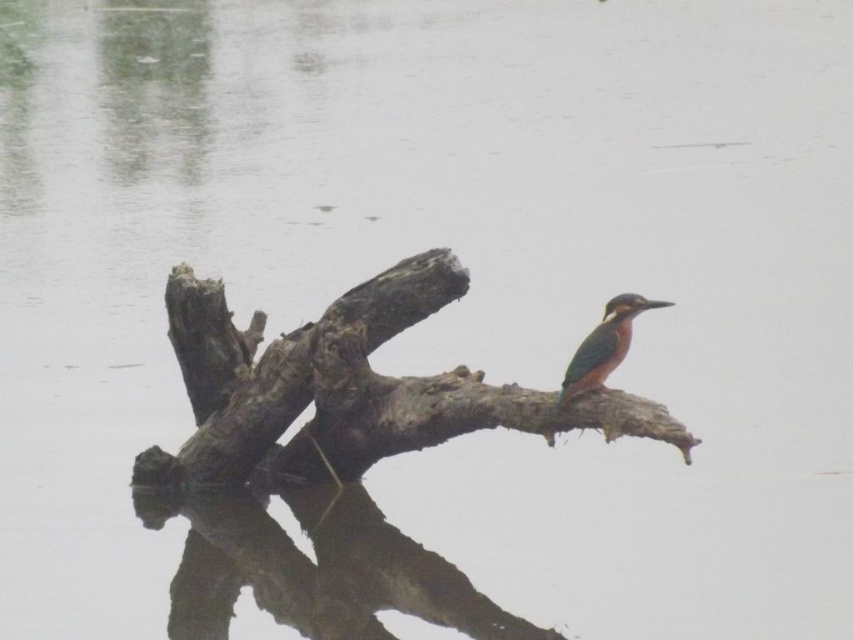
Question: Among these points, which one is nearest to the camera?

Choices:
 (A) (258, 436)
 (B) (607, 324)

Answer: (B)

Question: Which point appears farthest from the camera in this image?

Choices:
 (A) (598, 381)
 (B) (612, 436)

Answer: (B)

Question: Observing the image, what is the correct spatial positioning of rough bark branch at center in reference to green glossy bird at center?

Choices:
 (A) above
 (B) below

Answer: (B)

Question: Can you confirm if rough bark branch at center is positioned above green glossy bird at center?

Choices:
 (A) yes
 (B) no

Answer: (B)

Question: Which point is closer to the camera?

Choices:
 (A) (590, 380)
 (B) (314, 340)

Answer: (A)

Question: Is rough bark branch at center below green glossy bird at center?

Choices:
 (A) yes
 (B) no

Answer: (A)